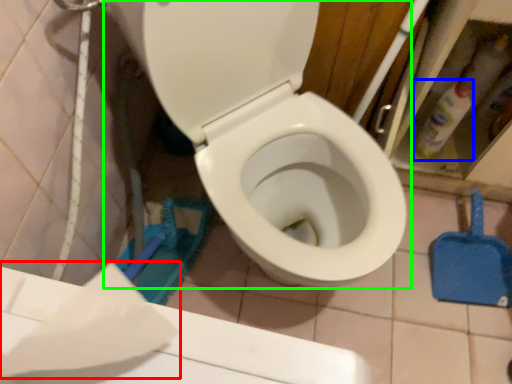
Question: Estimate the real-world distances between objects in this image. Which object is farther from toilet paper (highlighted by a red box), cleaning product (highlighted by a blue box) or toilet (highlighted by a green box)?

Choices:
 (A) cleaning product
 (B) toilet

Answer: (A)